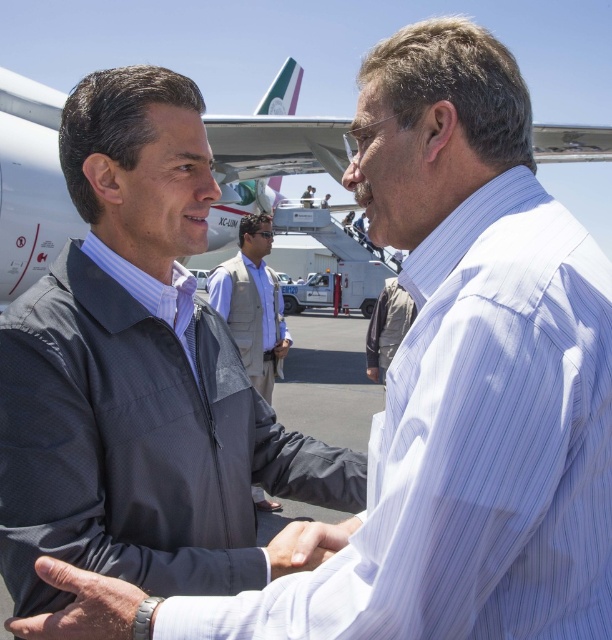
Question: Does light brown vest at center come in front of white matte hand at center?

Choices:
 (A) no
 (B) yes

Answer: (A)

Question: Is white metallic airplane at upper center above light brown vest at center?

Choices:
 (A) yes
 (B) no

Answer: (A)

Question: Which point appears closest to the camera in this image?

Choices:
 (A) (293, 541)
 (B) (271, 346)

Answer: (A)

Question: Which point is farther from the camera taking this photo?

Choices:
 (A) (324, 541)
 (B) (263, 500)
 (C) (143, 584)
 (D) (259, 209)

Answer: (D)

Question: Considering the real-world distances, which object is closest to the dark gray textured jacket at center?

Choices:
 (A) light brown vest at center
 (B) white metallic airplane at upper center
 (C) smooth skin hand at center

Answer: (C)

Question: Observing the image, what is the correct spatial positioning of smooth skin hand at center in reference to white matte hand at center?

Choices:
 (A) above
 (B) below

Answer: (B)